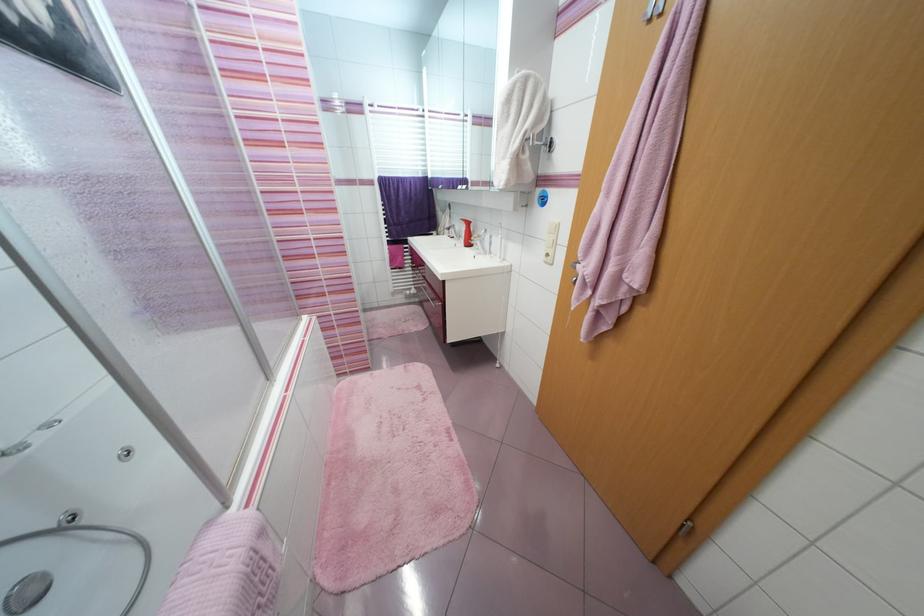
Locate an element on the screen. This screenshot has width=924, height=616. faucet lever handle is located at coordinates tap(480, 241).